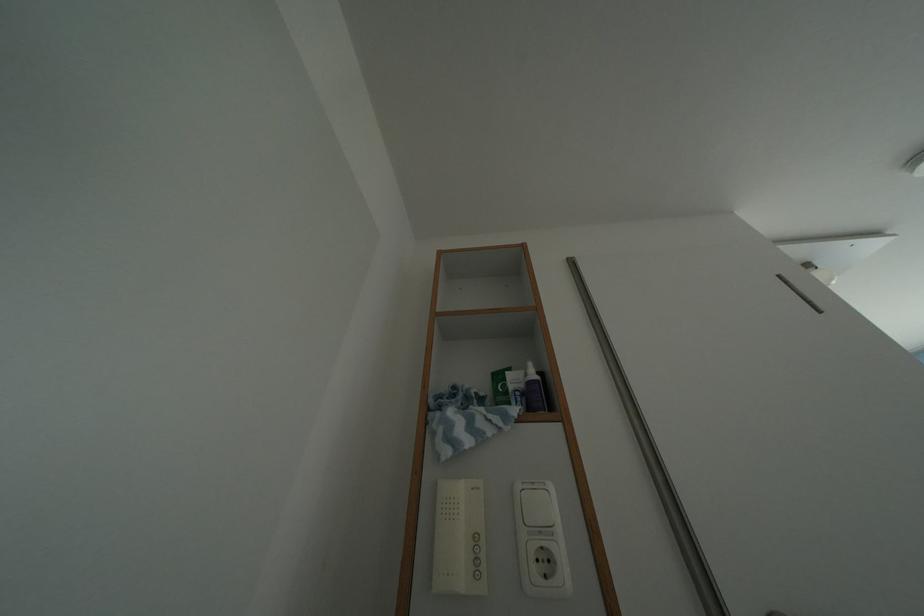
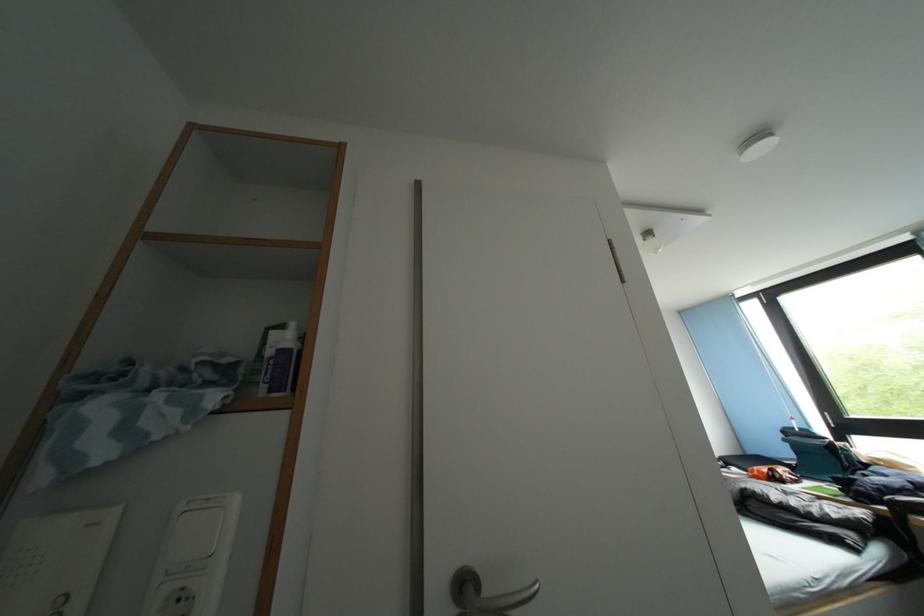
In the second image, find the point that corresponds to point (515, 378) in the first image.

(280, 337)